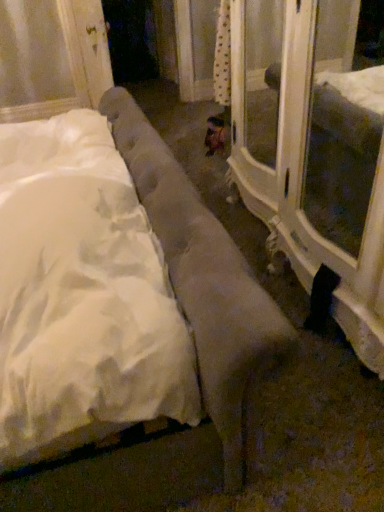
Where is `velvet gray sofa at center`? Image resolution: width=384 pixels, height=512 pixels. velvet gray sofa at center is located at coordinates (236, 341).

This screenshot has height=512, width=384. What do you see at coordinates (236, 341) in the screenshot? I see `velvet gray sofa at center` at bounding box center [236, 341].

You are a GUI agent. You are given a task and a screenshot of the screen. Output one action in this format:
    pyautogui.click(x=<x>, y=<y>)
    Task: Click on the velvet gray sofa at center
    
    Given the screenshot: What is the action you would take?
    pyautogui.click(x=236, y=341)